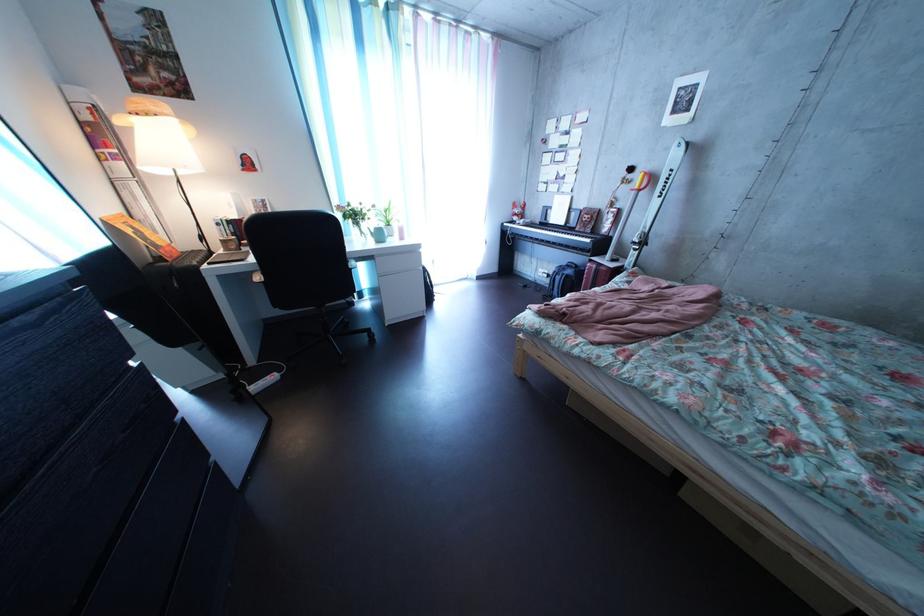
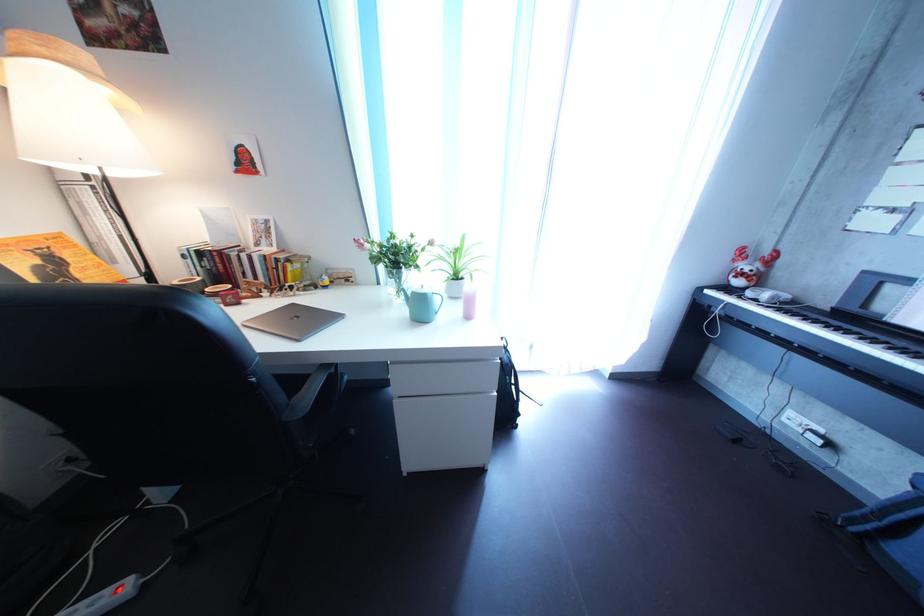
Locate, in the second image, the point that corresponds to point 542,229 in the first image.

(801, 304)